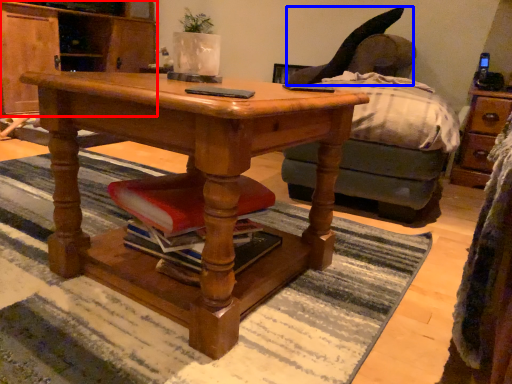
Question: Among these objects, which one is farthest to the camera, cabinetry (highlighted by a red box) or swivel chair (highlighted by a blue box)?

Choices:
 (A) cabinetry
 (B) swivel chair

Answer: (A)